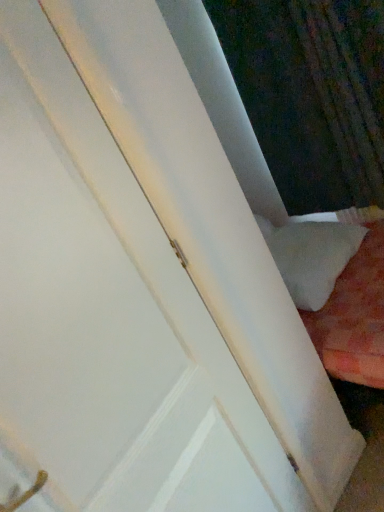
The image size is (384, 512). Describe the element at coordinates (311, 256) in the screenshot. I see `white soft pillow at center` at that location.

The width and height of the screenshot is (384, 512). I want to click on white soft pillow at center, so click(311, 256).

At what (x,y) coordinates should I click in order to perform the action: click on white soft pillow at center. Please return your answer as a coordinate pair (x, y). The image size is (384, 512). Looking at the image, I should click on (311, 256).